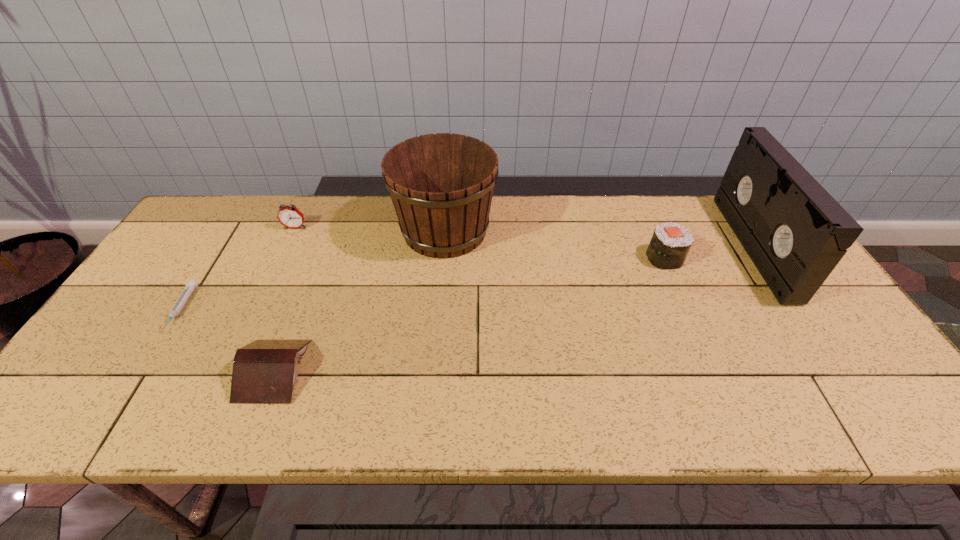
Image resolution: width=960 pixels, height=540 pixels. Identify the location of vacant space in between the videotape and the leftmost object. (467, 278).

At what (x,y) coordinates should I click in order to perform the action: click on vacant space that's between the syringe and the alarm clock. Please return your answer as a coordinate pair (x, y). This screenshot has width=960, height=540. Looking at the image, I should click on (238, 268).

Locate an element on the screen. The image size is (960, 540). unoccupied area between the book and the rightmost object is located at coordinates click(x=514, y=308).

Where is `vacant area that lies between the syringe and the alarm clock`? This screenshot has width=960, height=540. vacant area that lies between the syringe and the alarm clock is located at coordinates (238, 268).

This screenshot has height=540, width=960. Identify the location of free space between the book and the wine bucket. (359, 301).

Identify which object is the fourth closest to the nearest object. Please provide its 2D coordinates. Your answer should be formatted as a tuple, i.e. [(x, y)], where the tuple contains the x and y coordinates of a point satisfying the conditions above.

[(670, 244)]

At what (x,y) coordinates should I click in order to perform the action: click on the fifth closest object to the third object from right to left. Please return your answer as a coordinate pair (x, y). Looking at the image, I should click on (794, 231).

Where is `blank area in the image that satisfies the following two spatial constraints: 1. on the back side of the third object from right to left; 2. on the left side of the nearest object`? blank area in the image that satisfies the following two spatial constraints: 1. on the back side of the third object from right to left; 2. on the left side of the nearest object is located at coordinates click(327, 231).

Identify the location of vacant space that satisfies the following two spatial constraints: 1. on the side of the rightmost object with visible spindles; 2. on the front side of the sushi. (761, 258).

What are the coordinates of `vacant space that satisfies the following two spatial constraints: 1. at the needle end of the fifth tallest object; 2. on the right side of the shortest object` in the screenshot? It's located at (142, 370).